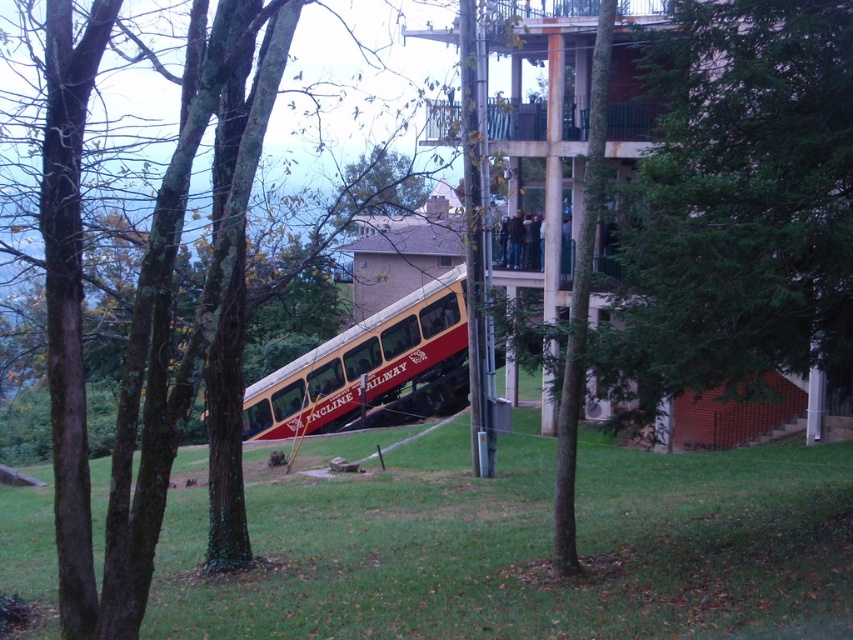
Question: Which point is closer to the camera?

Choices:
 (A) (238, 243)
 (B) (431, 284)

Answer: (A)

Question: Where is green bark tree at center located in relation to red polished wood passenger train at center in the image?

Choices:
 (A) above
 (B) below

Answer: (A)

Question: Which point appears farthest from the camera in this image?

Choices:
 (A) (84, 490)
 (B) (341, 362)

Answer: (B)

Question: Considering the relative positions of green bark tree at center and red polished wood passenger train at center in the image provided, where is green bark tree at center located with respect to red polished wood passenger train at center?

Choices:
 (A) right
 (B) left

Answer: (B)

Question: Can you confirm if green bark tree at center is positioned to the right of red polished wood passenger train at center?

Choices:
 (A) no
 (B) yes

Answer: (A)

Question: Which object appears closest to the camera in this image?

Choices:
 (A) green bark tree at center
 (B) red polished wood passenger train at center

Answer: (A)